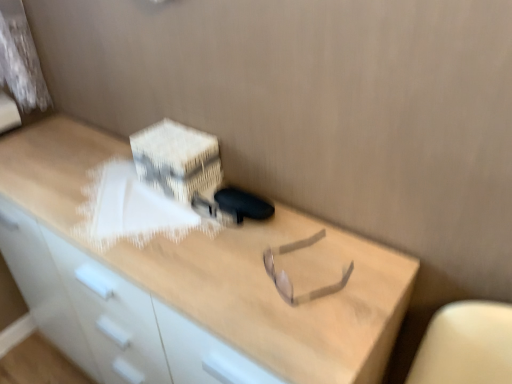
Identify the location of free space above light wood desk at center (from a real-world perspective). The height and width of the screenshot is (384, 512). (146, 214).